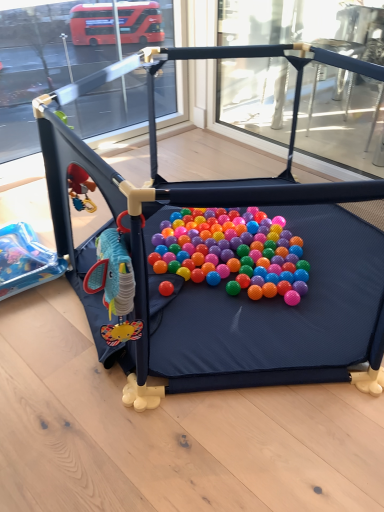
Where is `plastic blue toy at left, which appears as the first toy when viewed from the left`? plastic blue toy at left, which appears as the first toy when viewed from the left is located at coordinates (25, 260).

How much space does plastic blue toy at left, which appears as the first toy when viewed from the left, occupy vertically?

plastic blue toy at left, which appears as the first toy when viewed from the left, is 4.44 inches tall.

What is the approximate width of plastic blue toy at left, placed as the 2th toy when sorted from right to left?

The width of plastic blue toy at left, placed as the 2th toy when sorted from right to left, is 35.76 centimeters.

What do you see at coordinates (25, 260) in the screenshot?
I see `plastic blue toy at left, placed as the 2th toy when sorted from right to left` at bounding box center [25, 260].

Where is `rubberized plastic ball pit at center, arranged as the 2th toy when viewed from the left`? The width and height of the screenshot is (384, 512). rubberized plastic ball pit at center, arranged as the 2th toy when viewed from the left is located at coordinates (220, 287).

Measure the distance between rubberized plastic ball pit at center, arranged as the 2th toy when viewed from the left, and camera.

The depth of rubberized plastic ball pit at center, arranged as the 2th toy when viewed from the left, is 34.45 inches.

Describe the element at coordinates (220, 287) in the screenshot. This screenshot has width=384, height=512. I see `rubberized plastic ball pit at center, which ranks as the 1th toy in right-to-left order` at that location.

Identify the location of plastic blue toy at left, placed as the 2th toy when sorted from right to left. (25, 260).

Which object is positioned more to the left, rubberized plastic ball pit at center, arranged as the 2th toy when viewed from the left, or plastic blue toy at left, placed as the 2th toy when sorted from right to left?

Positioned to the left is plastic blue toy at left, placed as the 2th toy when sorted from right to left.

Considering their positions, is rubberized plastic ball pit at center, which ranks as the 1th toy in right-to-left order, located in front of or behind plastic blue toy at left, which appears as the first toy when viewed from the left?

rubberized plastic ball pit at center, which ranks as the 1th toy in right-to-left order, is positioned closer to the viewer than plastic blue toy at left, which appears as the first toy when viewed from the left.

Does point (197, 359) appear closer or farther from the camera than point (22, 271)?

Point (197, 359) is positioned closer to the camera compared to point (22, 271).

From the image's perspective, which is above, rubberized plastic ball pit at center, arranged as the 2th toy when viewed from the left, or plastic blue toy at left, which appears as the first toy when viewed from the left?

rubberized plastic ball pit at center, arranged as the 2th toy when viewed from the left, is shown above in the image.

From a real-world perspective, who is located lower, rubberized plastic ball pit at center, which ranks as the 1th toy in right-to-left order, or plastic blue toy at left, which appears as the first toy when viewed from the left?

From a 3D spatial view, plastic blue toy at left, which appears as the first toy when viewed from the left, is below.

Considering the relative sizes of rubberized plastic ball pit at center, which ranks as the 1th toy in right-to-left order, and plastic blue toy at left, which appears as the first toy when viewed from the left, in the image provided, is rubberized plastic ball pit at center, which ranks as the 1th toy in right-to-left order, thinner than plastic blue toy at left, which appears as the first toy when viewed from the left,?

In fact, rubberized plastic ball pit at center, which ranks as the 1th toy in right-to-left order, might be wider than plastic blue toy at left, which appears as the first toy when viewed from the left.

Which of these two, rubberized plastic ball pit at center, arranged as the 2th toy when viewed from the left, or plastic blue toy at left, which appears as the first toy when viewed from the left, stands shorter?

With less height is plastic blue toy at left, which appears as the first toy when viewed from the left.

Based on their sizes in the image, would you say rubberized plastic ball pit at center, arranged as the 2th toy when viewed from the left, is bigger or smaller than plastic blue toy at left, placed as the 2th toy when sorted from right to left?

rubberized plastic ball pit at center, arranged as the 2th toy when viewed from the left, is bigger than plastic blue toy at left, placed as the 2th toy when sorted from right to left.

Is plastic blue toy at left, placed as the 2th toy when sorted from right to left, inside rubberized plastic ball pit at center, arranged as the 2th toy when viewed from the left?

Yes, plastic blue toy at left, placed as the 2th toy when sorted from right to left, is a part of rubberized plastic ball pit at center, arranged as the 2th toy when viewed from the left.

Is rubberized plastic ball pit at center, which ranks as the 1th toy in right-to-left order, looking in the opposite direction of plastic blue toy at left, which appears as the first toy when viewed from the left?

Yes, rubberized plastic ball pit at center, which ranks as the 1th toy in right-to-left order, is facing away from plastic blue toy at left, which appears as the first toy when viewed from the left.

How distant is rubberized plastic ball pit at center, arranged as the 2th toy when viewed from the left, from plastic blue toy at left, which appears as the first toy when viewed from the left?

21.13 inches.

I want to click on toy on the left of rubberized plastic ball pit at center, arranged as the 2th toy when viewed from the left, so tap(25, 260).

In the scene shown: Which object is positioned more to the left, plastic blue toy at left, which appears as the first toy when viewed from the left, or rubberized plastic ball pit at center, arranged as the 2th toy when viewed from the left?

Positioned to the left is plastic blue toy at left, which appears as the first toy when viewed from the left.

Which object is closer to the camera, plastic blue toy at left, placed as the 2th toy when sorted from right to left, or rubberized plastic ball pit at center, which ranks as the 1th toy in right-to-left order?

Positioned in front is rubberized plastic ball pit at center, which ranks as the 1th toy in right-to-left order.

Between point (1, 269) and point (323, 308), which one is positioned behind?

The point (1, 269) is farther from the camera.

Based on the photo, from the image's perspective, relative to rubberized plastic ball pit at center, which ranks as the 1th toy in right-to-left order, is plastic blue toy at left, which appears as the first toy when viewed from the left, above or below?

From the image's perspective, plastic blue toy at left, which appears as the first toy when viewed from the left, appears below rubberized plastic ball pit at center, which ranks as the 1th toy in right-to-left order.

From a real-world perspective, is plastic blue toy at left, which appears as the first toy when viewed from the left, positioned under rubberized plastic ball pit at center, which ranks as the 1th toy in right-to-left order, based on gravity?

Yes.

Considering the relative sizes of plastic blue toy at left, placed as the 2th toy when sorted from right to left, and rubberized plastic ball pit at center, arranged as the 2th toy when viewed from the left, in the image provided, is plastic blue toy at left, placed as the 2th toy when sorted from right to left, wider than rubberized plastic ball pit at center, arranged as the 2th toy when viewed from the left,?

No.

Who is shorter, plastic blue toy at left, placed as the 2th toy when sorted from right to left, or rubberized plastic ball pit at center, arranged as the 2th toy when viewed from the left?

plastic blue toy at left, placed as the 2th toy when sorted from right to left, is shorter.

Which of these two, plastic blue toy at left, placed as the 2th toy when sorted from right to left, or rubberized plastic ball pit at center, arranged as the 2th toy when viewed from the left, is smaller?

With smaller size is plastic blue toy at left, placed as the 2th toy when sorted from right to left.

Is plastic blue toy at left, placed as the 2th toy when sorted from right to left, completely or partially outside of rubberized plastic ball pit at center, arranged as the 2th toy when viewed from the left?

No, plastic blue toy at left, placed as the 2th toy when sorted from right to left, is inside or overlapping with rubberized plastic ball pit at center, arranged as the 2th toy when viewed from the left.

Is plastic blue toy at left, which appears as the first toy when viewed from the left, next to rubberized plastic ball pit at center, arranged as the 2th toy when viewed from the left, and touching it?

No.

Is plastic blue toy at left, placed as the 2th toy when sorted from right to left, turned away from rubberized plastic ball pit at center, arranged as the 2th toy when viewed from the left?

Yes, plastic blue toy at left, placed as the 2th toy when sorted from right to left, is positioned with its back facing rubberized plastic ball pit at center, arranged as the 2th toy when viewed from the left.

What's the angular difference between plastic blue toy at left, which appears as the first toy when viewed from the left, and rubberized plastic ball pit at center, which ranks as the 1th toy in right-to-left order,'s facing directions?

The facing directions of plastic blue toy at left, which appears as the first toy when viewed from the left, and rubberized plastic ball pit at center, which ranks as the 1th toy in right-to-left order, are 87.1 degrees apart.

How much distance is there between plastic blue toy at left, placed as the 2th toy when sorted from right to left, and rubberized plastic ball pit at center, which ranks as the 1th toy in right-to-left order?

21.13 inches.

The width and height of the screenshot is (384, 512). I want to click on toy below the rubberized plastic ball pit at center, which ranks as the 1th toy in right-to-left order (from a real-world perspective), so click(25, 260).

Find the location of a particular element. toy in front of the plastic blue toy at left, which appears as the first toy when viewed from the left is located at coordinates (220, 287).

What are the coordinates of `toy above the plastic blue toy at left, placed as the 2th toy when sorted from right to left (from a real-world perspective)` in the screenshot? It's located at [x=220, y=287].